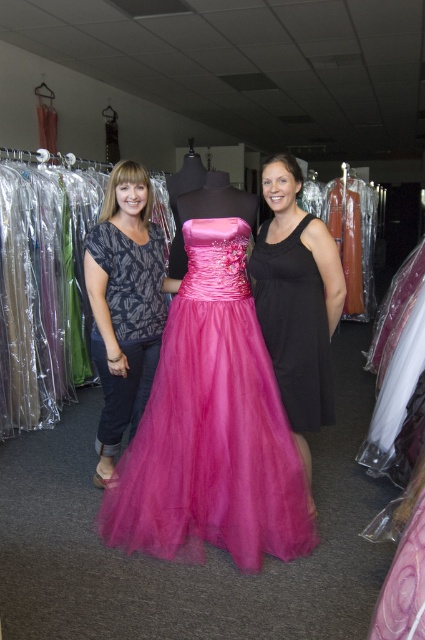
You are a customer in a dress shop and want to know which item takes up more space between the fuchsia tulle dress at center and the matte black blouse at center. Which one is it?

The matte black blouse at center takes up more space than the fuchsia tulle dress at center.

Please look at the image of the dress shop. There is a woman on the left wearing a dark blue patterned top and dark jeans, and a woman on the right with her hair pulled back. In the center of the image, there is a point marked at coordinates (124, 305). Which object in the scene corresponds to this point?

The point at (124, 305) corresponds to the matte black blouse at center.

You are a customer in the dress shop and want to find the matte black blouse at center. Based on the coordinates provided, where should you look in the image?

The matte black blouse at center is located at point coordinates (124,305), so you should look towards the center area of the image slightly to the right and lower middle section.